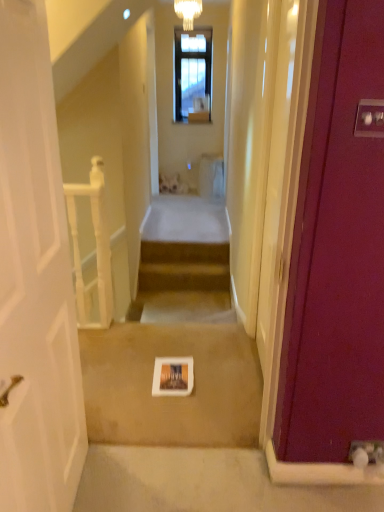
Locate an element on the screen. The image size is (384, 512). vacant space situated above white matte book at center (from a real-world perspective) is located at coordinates (154, 364).